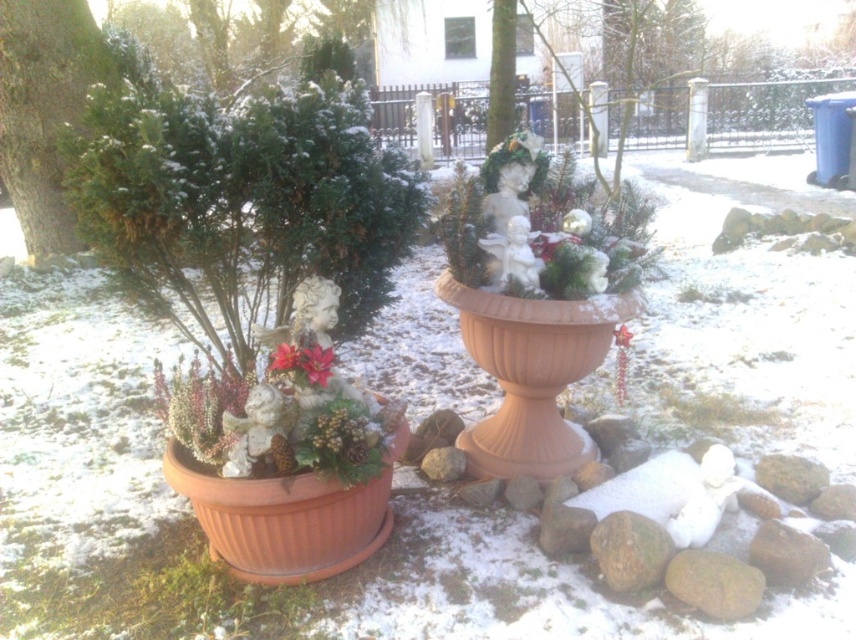
Question: Which point is farther from the camera taking this photo?

Choices:
 (A) (24, 122)
 (B) (275, 358)
 (C) (290, 358)
 (D) (327, 356)

Answer: (A)

Question: Is green textured evergreen tree at left wider than pink matte flower at center?

Choices:
 (A) no
 (B) yes

Answer: (B)

Question: Observing the image, what is the correct spatial positioning of poinsettia matte at center in reference to matte red flower at center?

Choices:
 (A) below
 (B) above

Answer: (A)

Question: Which point is farther to the camera?

Choices:
 (A) (281, 362)
 (B) (22, 202)

Answer: (B)

Question: Which point appears farthest from the camera in this image?

Choices:
 (A) (321, 362)
 (B) (289, 355)

Answer: (A)

Question: Is green textured evergreen tree at left smaller than pink matte flower at center?

Choices:
 (A) no
 (B) yes

Answer: (A)